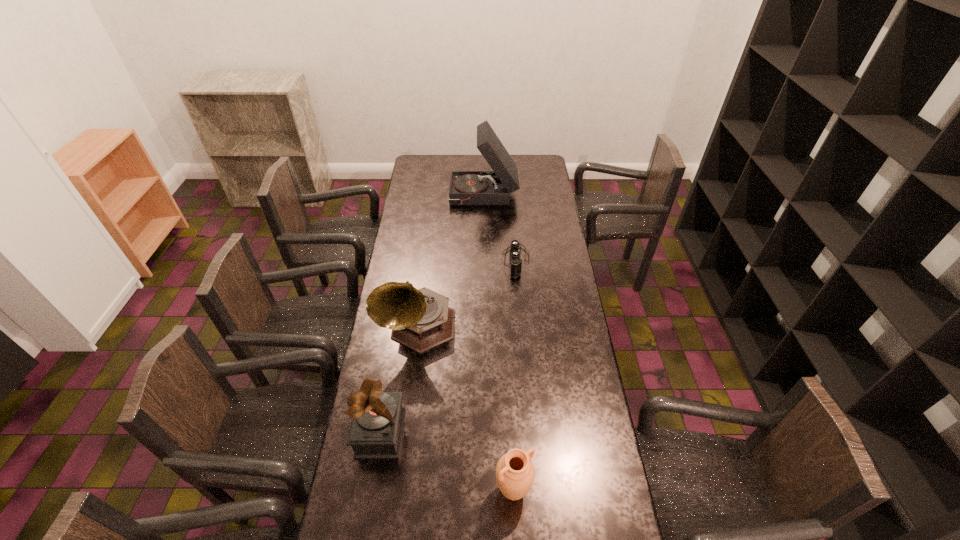
Image resolution: width=960 pixels, height=540 pixels. In order to click on the farthest phonograph_record in this screenshot , I will do `click(494, 187)`.

Identify the location of the farthest object. (494, 187).

The width and height of the screenshot is (960, 540). What are the coordinates of `the third farthest object` in the screenshot? It's located at (420, 319).

This screenshot has width=960, height=540. Find the location of `the second nearest object`. the second nearest object is located at coordinates pos(375,432).

Where is `the second shortest object`? This screenshot has height=540, width=960. the second shortest object is located at coordinates (515, 473).

Where is `urn`? urn is located at coordinates (515, 473).

What are the coordinates of `the shortest object` in the screenshot? It's located at [x=515, y=249].

The height and width of the screenshot is (540, 960). Find the location of `the second farthest object`. the second farthest object is located at coordinates [515, 249].

At what (x,y) coordinates should I click in order to perform the action: click on free region located 0.200m on the front-facing side of the tallest object. Please return your answer as a coordinate pair (x, y). This screenshot has height=540, width=960. Looking at the image, I should click on click(x=412, y=196).

Locate an element on the screen. Image resolution: width=960 pixels, height=540 pixels. free space located 0.220m on the front-facing side of the tallest object is located at coordinates (408, 196).